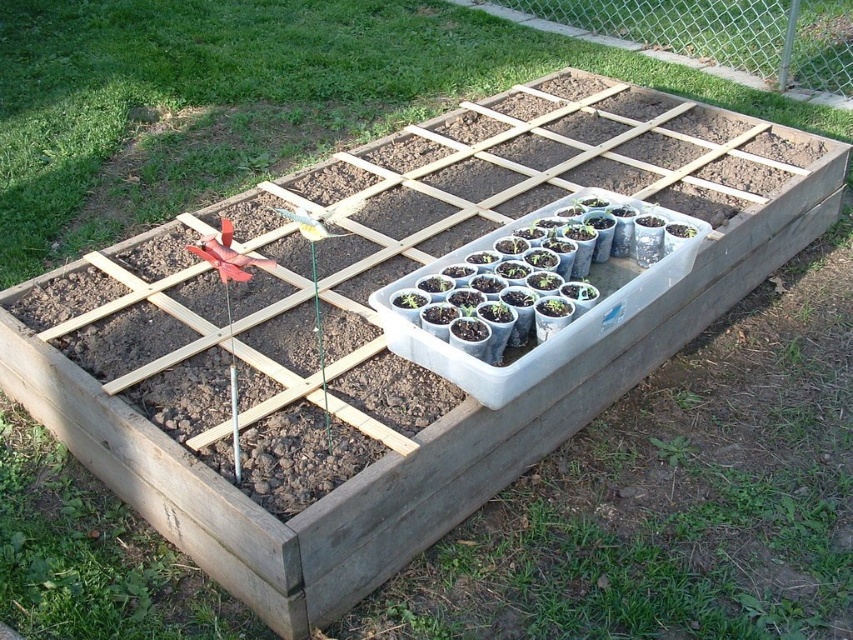
You are a gardener who wants to move the clear plastic tray of seedlings at center to the back of the garden bed. Can you reach it without moving the matte plastic tray at center?

The matte plastic tray at center is further to the viewer than clear plastic tray of seedlings at center, so the clear plastic tray of seedlings at center is actually behind the matte plastic tray at center. Therefore, you can reach it without moving the matte plastic tray at center because it is positioned behind.